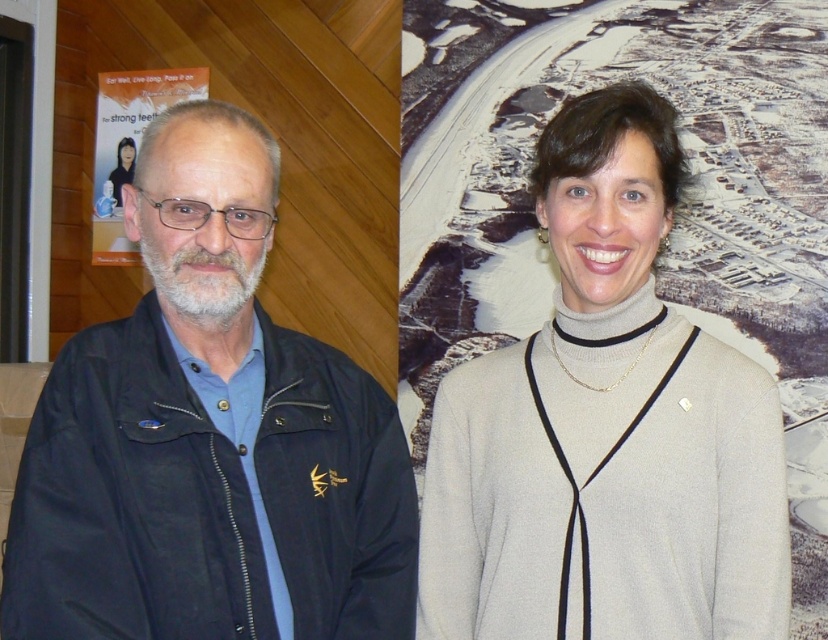
What is the color of the clothing item located at the coordinates point (605, 429)?

The point (605, 429) marks the light gray sweater at center, so the color is light gray.

You are a photographer standing 1.5 meters away from the camera. You want to take a closeup shot of the light gray sweater at center. Can you reach it without moving your camera?

The light gray sweater at center is 1.27 meters away from the camera. Since you are standing 1.5 meters away from the camera, you are 0.23 meters farther than the sweater. Therefore, you can reach it without moving your camera by adjusting your position closer or using a zoom lens.